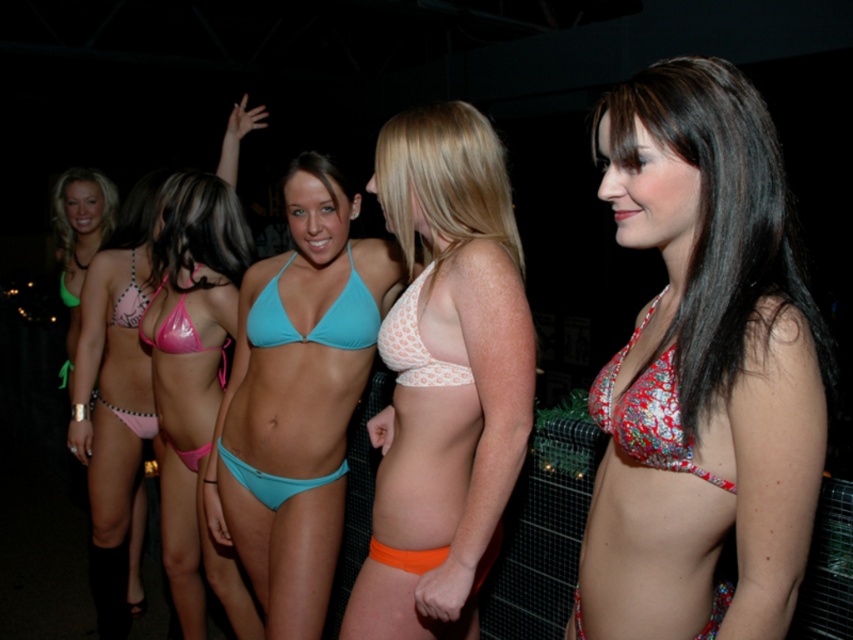
At what (x,y) coordinates should I click in order to perform the action: click on printed fabric bikini top at center. Please return your answer as a coordinate pair (x, y). The width and height of the screenshot is (853, 640). Looking at the image, I should click on (701, 369).

Is printed fabric bikini top at center thinner than matte pink bikini bottom at center?

Yes.

You are a GUI agent. You are given a task and a screenshot of the screen. Output one action in this format:
    pyautogui.click(x=<x>, y=<y>)
    Task: Click on the printed fabric bikini top at center
    
    Given the screenshot: What is the action you would take?
    pyautogui.click(x=701, y=369)

Locate an element on the screen. This screenshot has height=640, width=853. printed fabric bikini top at center is located at coordinates (701, 369).

Consider the image. Can you confirm if printed fabric bikini top at right is positioned to the right of white dotted fabric bikini bottom at center?

Yes, printed fabric bikini top at right is to the right of white dotted fabric bikini bottom at center.

From the picture: Does printed fabric bikini top at right have a lesser width compared to white dotted fabric bikini bottom at center?

No, printed fabric bikini top at right is not thinner than white dotted fabric bikini bottom at center.

This screenshot has width=853, height=640. Describe the element at coordinates (647, 412) in the screenshot. I see `printed fabric bikini top at right` at that location.

In order to click on printed fabric bikini top at right in this screenshot , I will do `click(647, 412)`.